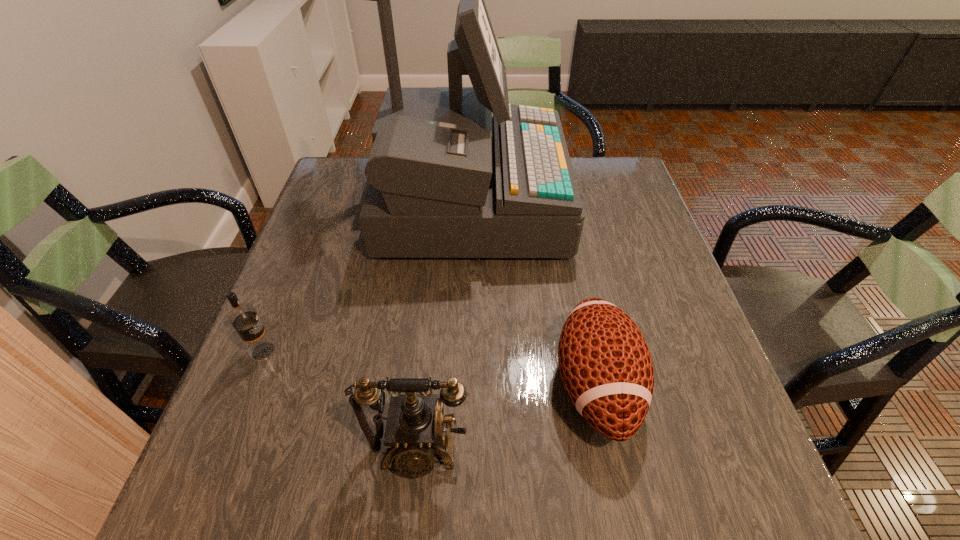
You are a GUI agent. You are given a task and a screenshot of the screen. Output one action in this format:
    pyautogui.click(x=<x>, y=<y>)
    Task: Click on the farthest object
    
    Given the screenshot: What is the action you would take?
    pyautogui.click(x=447, y=179)

You are a GUI agent. You are given a task and a screenshot of the screen. Output one action in this format:
    pyautogui.click(x=<x>, y=<y>)
    Task: Click on the cash register
    The width and height of the screenshot is (960, 540).
    Given the screenshot: What is the action you would take?
    pyautogui.click(x=447, y=179)

This screenshot has height=540, width=960. Find the location of `telephone`. telephone is located at coordinates pyautogui.click(x=414, y=432).

Identify the location of vodka. (243, 317).

Where is `football`? Image resolution: width=960 pixels, height=540 pixels. football is located at coordinates (605, 364).

This screenshot has width=960, height=540. What are the coordinates of `free region located on the rotary dial of the telephone` in the screenshot? It's located at pos(410,517).

At what (x,y) coordinates should I click in order to perform the action: click on blank space located 0.350m on the label of the leftmost object. Please return your answer as a coordinate pair (x, y). The image size is (960, 540). Looking at the image, I should click on (450, 351).

I want to click on vacant space located 0.080m on the left of the football, so click(x=512, y=386).

Locate an element on the screen. Image resolution: width=960 pixels, height=540 pixels. object that is at the far edge is located at coordinates (447, 179).

Locate an element on the screen. This screenshot has height=540, width=960. telephone positioned at the near edge is located at coordinates (414, 432).